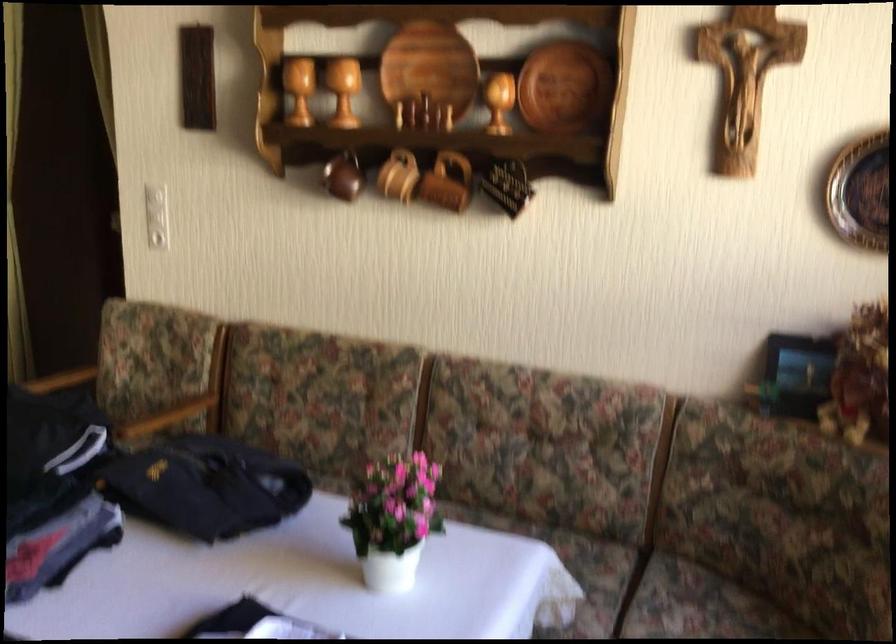
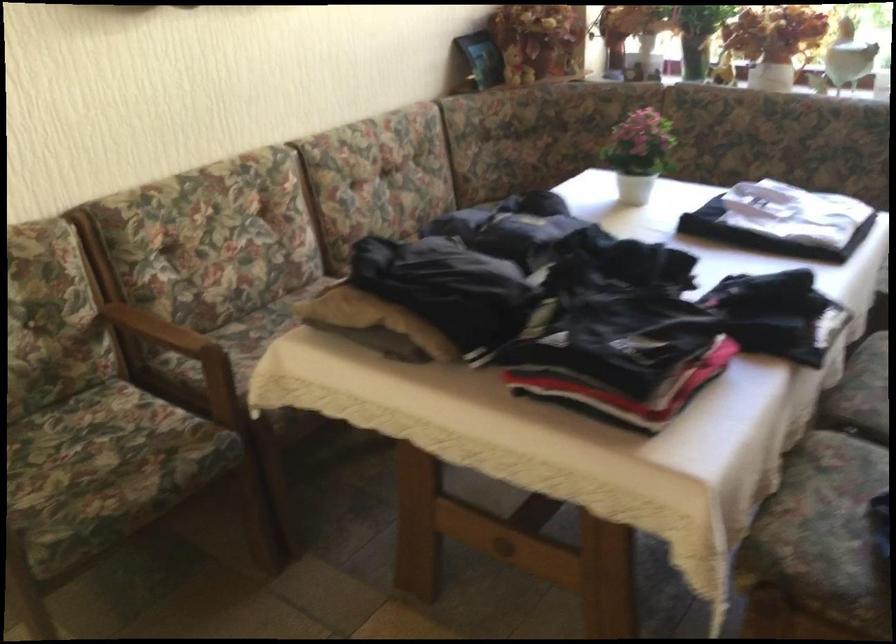
Where in the second image is the point corresponding to point (165, 408) from the first image?

(158, 328)